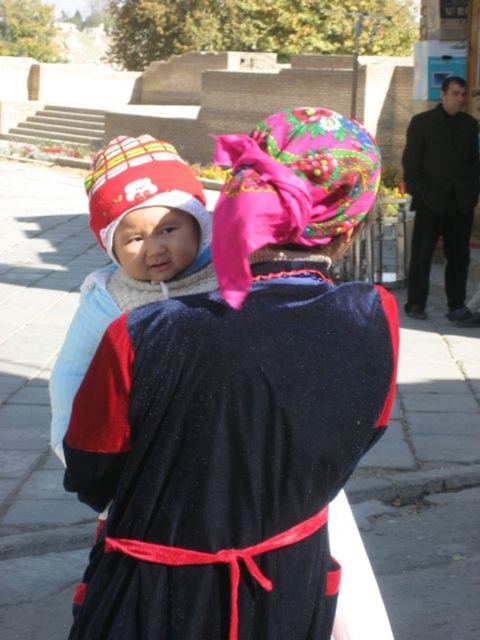
You are a photographer trying to capture a photo of the velvet dark blue dress at center and the black matte robe at right. If your camera has a maximum focus range of 6 meters, will you be able to focus on both subjects simultaneously?

The velvet dark blue dress at center is 6.26 meters from the black matte robe at right. Since the distance between them exceeds the camera lens focus range of 6 meters, you cannot focus on both subjects at the same time.

You are an artist preparing to sketch the scene. You need to ensure the proportions are accurate. Which object in the scene has a greater width when comparing the velvet dark blue dress at center and the matte red knit hat at left?

The velvet dark blue dress at center has a greater width than the matte red knit hat at left.

You are standing at the entrance of the building in the background and want to approach the velvet dark blue dress at center. Which direction should you walk to reach it?

The velvet dark blue dress at center is located at point 0.713 on the x and 0.475 on the y. Since you are at the entrance of the building in the background, you should walk forward and to the right to reach the velvet dark blue dress at center.